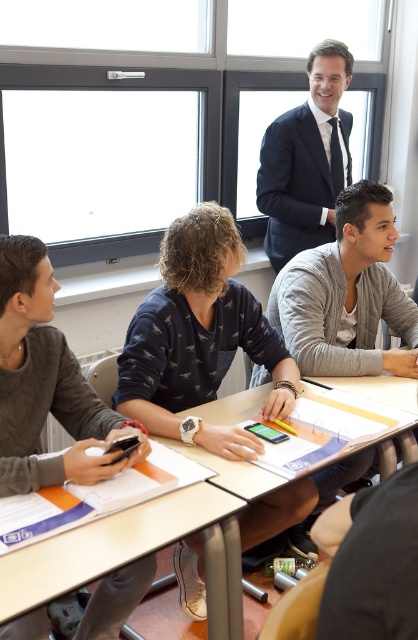
What do you see at coordinates (199, 339) in the screenshot? I see `dark blue sweater at center` at bounding box center [199, 339].

Does dark blue sweater at center lie behind wooden table at center?

Yes, it is.

Is point (173, 333) farther from camera compared to point (232, 486)?

That is True.

At what (x,y) coordinates should I click in order to perform the action: click on dark blue sweater at center. Please return your answer as a coordinate pair (x, y). The width and height of the screenshot is (418, 640). Looking at the image, I should click on (199, 339).

Is dark blue sweater at center below wooden desk at center?

Actually, dark blue sweater at center is above wooden desk at center.

Is dark blue sweater at center wider than wooden desk at center?

Yes.

This screenshot has height=640, width=418. What do you see at coordinates (199, 339) in the screenshot?
I see `dark blue sweater at center` at bounding box center [199, 339].

Image resolution: width=418 pixels, height=640 pixels. Find the location of `dark blue sweater at center`. dark blue sweater at center is located at coordinates (199, 339).

Which is behind, point (193, 365) or point (308, 118)?

Positioned behind is point (308, 118).

Does dark blue sweater at center have a greater height compared to dark blue suit at upper center?

No, dark blue sweater at center is not taller than dark blue suit at upper center.

Is point (120, 380) in front of point (313, 90)?

Yes, point (120, 380) is in front of point (313, 90).

Locate an element on the screen. This screenshot has height=640, width=418. dark blue sweater at center is located at coordinates (199, 339).